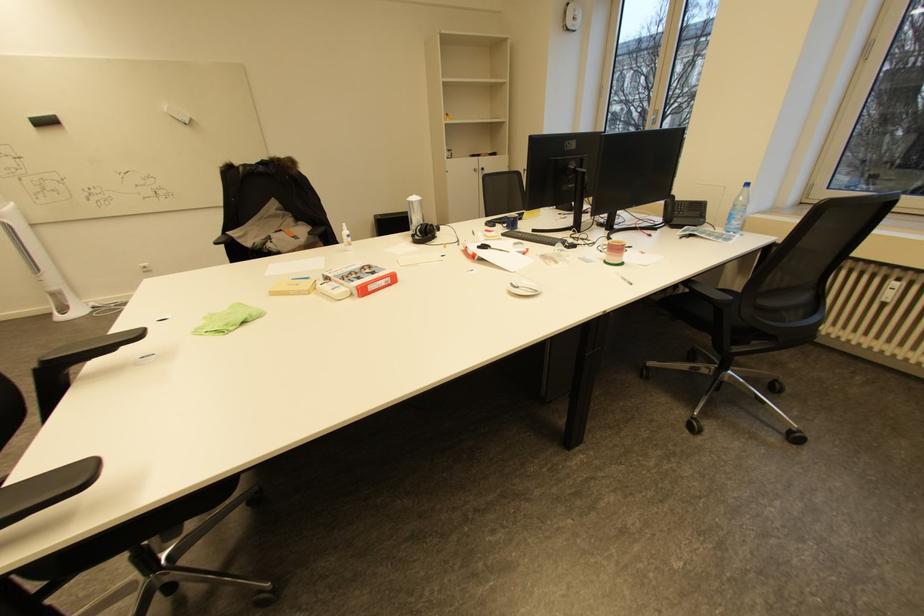
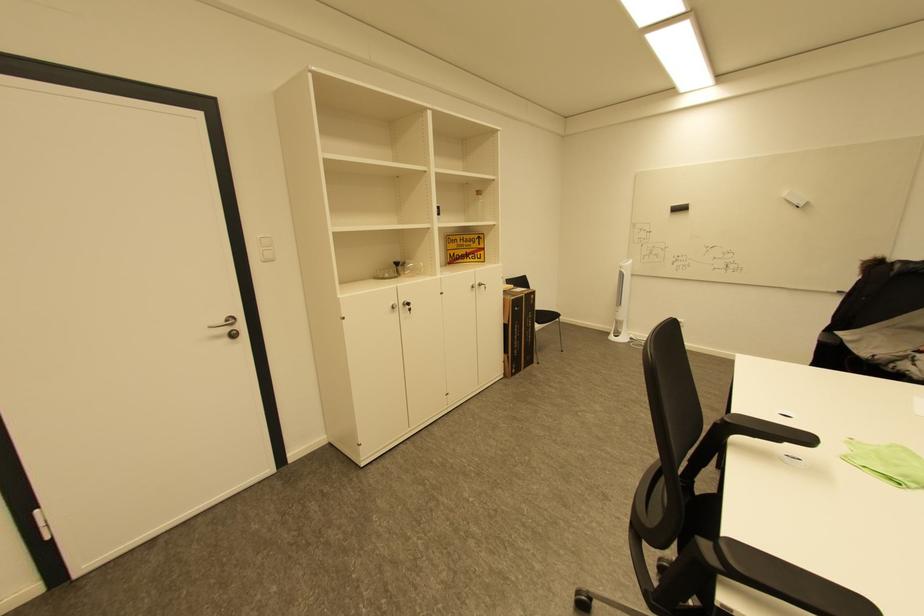
In the second image, find the point that corresponds to (x=52, y=122) in the first image.

(686, 209)